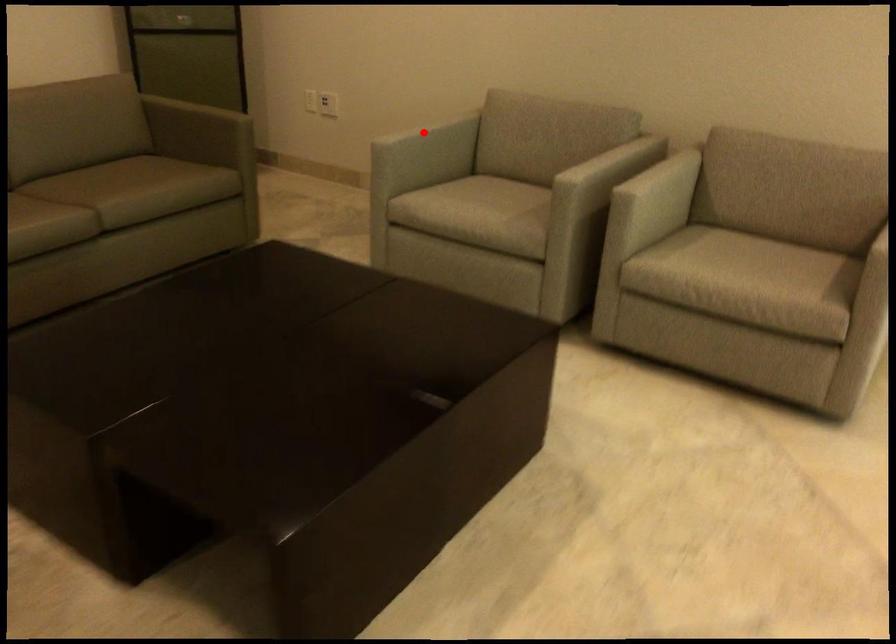
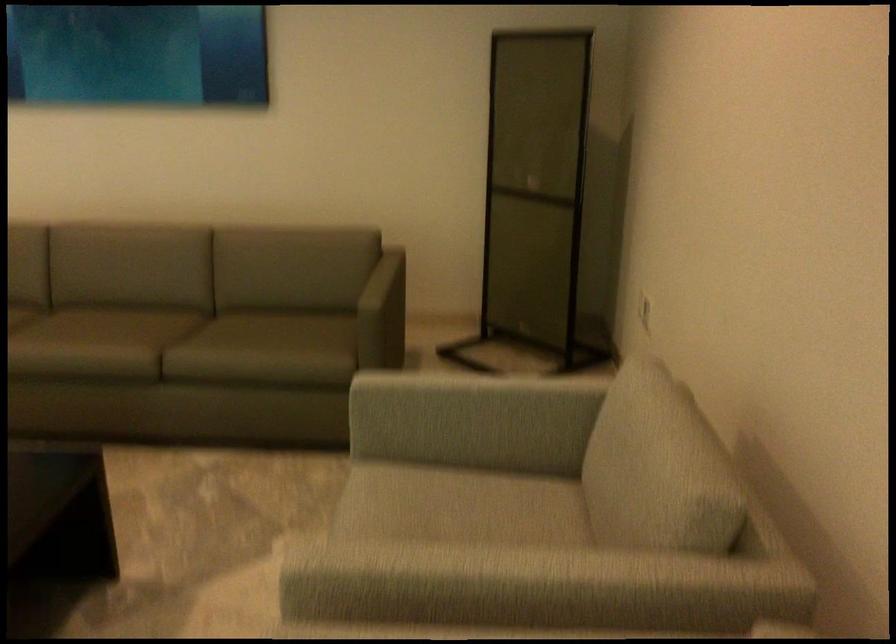
Question: I am providing you with two images of the same scene from different viewpoints. A red point is marked on the first image. At the location where the point appears in image 1, is it still visible in image 2?

Choices:
 (A) Yes
 (B) No

Answer: (A)